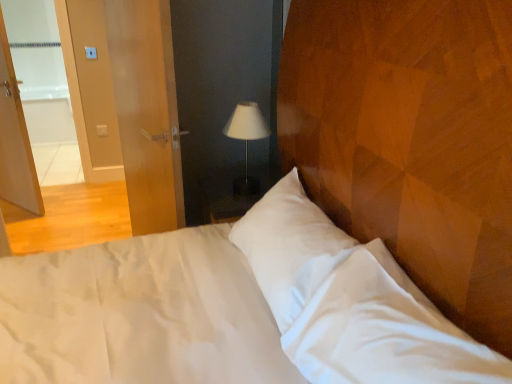
Question: Is the position of matte wood door at left less distant than that of white plastic light switch at upper left?

Choices:
 (A) yes
 (B) no

Answer: (A)

Question: Is matte wood door at left smaller than white plastic light switch at upper left?

Choices:
 (A) yes
 (B) no

Answer: (B)

Question: Does matte wood door at left have a greater width compared to white plastic light switch at upper left?

Choices:
 (A) yes
 (B) no

Answer: (A)

Question: Is matte wood door at left bigger than white plastic light switch at upper left?

Choices:
 (A) no
 (B) yes

Answer: (B)

Question: Is matte wood door at left beside white plastic light switch at upper left?

Choices:
 (A) yes
 (B) no

Answer: (B)

Question: Is matte wood door at left taller than white plastic light switch at upper left?

Choices:
 (A) no
 (B) yes

Answer: (B)

Question: Considering the relative sizes of white fabric lampshade at center and white plastic light switch at upper left in the image provided, is white fabric lampshade at center wider than white plastic light switch at upper left?

Choices:
 (A) no
 (B) yes

Answer: (B)

Question: From a real-world perspective, is white fabric lampshade at center positioned under white plastic light switch at upper left based on gravity?

Choices:
 (A) no
 (B) yes

Answer: (A)

Question: Is white fabric lampshade at center further to camera compared to white plastic light switch at upper left?

Choices:
 (A) no
 (B) yes

Answer: (A)

Question: Is white plastic light switch at upper left inside white fabric lampshade at center?

Choices:
 (A) no
 (B) yes

Answer: (A)

Question: Can you confirm if white fabric lampshade at center is positioned to the right of white plastic light switch at upper left?

Choices:
 (A) yes
 (B) no

Answer: (A)

Question: Is white fabric lampshade at center completely or partially outside of white plastic light switch at upper left?

Choices:
 (A) yes
 (B) no

Answer: (A)

Question: From a real-world perspective, is matte wood door at left physically below white fabric lampshade at center?

Choices:
 (A) no
 (B) yes

Answer: (B)